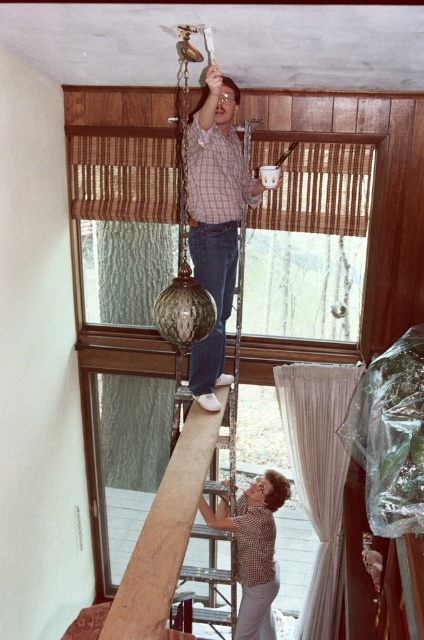
Question: Can you confirm if sheer white curtain at lower right is smaller than checkered shirt at center?

Choices:
 (A) no
 (B) yes

Answer: (B)

Question: Which point is farther to the camera?

Choices:
 (A) (200, 458)
 (B) (309, 365)

Answer: (B)

Question: Which point is farther to the camera?

Choices:
 (A) (166, 520)
 (B) (194, 362)
 (C) (259, 529)

Answer: (C)

Question: Does brown wooden beam at center appear on the left side of checkered shirt at center?

Choices:
 (A) no
 (B) yes

Answer: (B)

Question: Which point appears farthest from the camera in this image?

Choices:
 (A) (184, 531)
 (B) (253, 497)

Answer: (B)

Question: Does matte plaid shirt at center lie in front of checkered shirt at center?

Choices:
 (A) no
 (B) yes

Answer: (B)